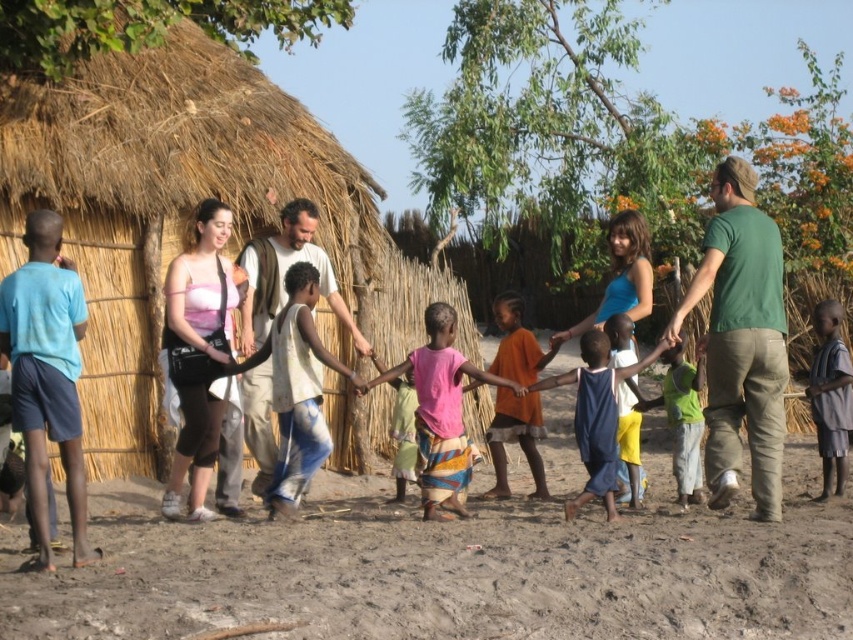
Question: Does brown sandy dirt at lower center come behind green fabric shirt at center?

Choices:
 (A) yes
 (B) no

Answer: (B)

Question: Is pink fabric skirt at center to the right of light blue fabric at lower right from the viewer's perspective?

Choices:
 (A) no
 (B) yes

Answer: (A)

Question: Which object is closer to the camera taking this photo?

Choices:
 (A) green fabric shirt at center
 (B) blue fabric dress at center
 (C) green cotton shirt at right

Answer: (C)

Question: Which object appears farthest from the camera in this image?

Choices:
 (A) blue fabric dress at center
 (B) green fabric shirt at center

Answer: (B)

Question: Which object is the closest to the green fabric shirt at center?

Choices:
 (A) blue fabric dress at center
 (B) brown sandy dirt at lower center
 (C) green cotton shirt at right
 (D) orange fabric skirt at center

Answer: (C)

Question: Is light blue fabric at lower right above green fabric shirt at center?

Choices:
 (A) no
 (B) yes

Answer: (B)